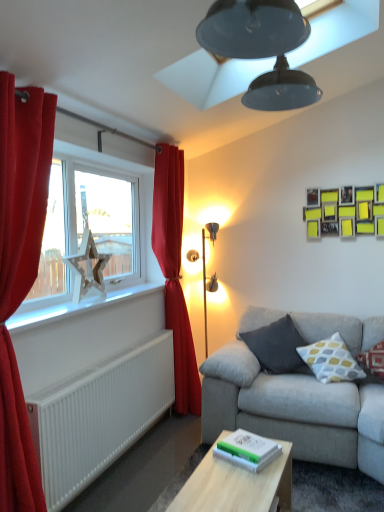
Question: Is velvet red curtain at left, the second curtain viewed from the back, bigger than white plastic window sill at left?

Choices:
 (A) yes
 (B) no

Answer: (A)

Question: Is velvet red curtain at left, marked as the 1th curtain in a front-to-back arrangement, wider than white plastic window sill at left?

Choices:
 (A) no
 (B) yes

Answer: (A)

Question: Does velvet red curtain at left, the 1th curtain in the left-to-right sequence, have a greater height compared to white plastic window sill at left?

Choices:
 (A) yes
 (B) no

Answer: (A)

Question: Is velvet red curtain at left, the 1th curtain in the left-to-right sequence, shorter than white plastic window sill at left?

Choices:
 (A) no
 (B) yes

Answer: (A)

Question: Is velvet red curtain at left, positioned as the 2th curtain in right-to-left order, positioned far away from white plastic window sill at left?

Choices:
 (A) no
 (B) yes

Answer: (A)

Question: Is yellow-grey dotted cushion at right, the second pillow from the left, inside or outside of red velvet curtain at left, the 1th curtain when ordered from right to left?

Choices:
 (A) outside
 (B) inside

Answer: (A)

Question: From a real-world perspective, relative to red velvet curtain at left, positioned as the 2th curtain in left-to-right order, is yellow-grey dotted cushion at right, which is the 2th pillow from right to left, vertically above or below?

Choices:
 (A) below
 (B) above

Answer: (A)

Question: Is yellow-grey dotted cushion at right, which is the 2th pillow from right to left, to the left or to the right of red velvet curtain at left, the 1th curtain when ordered from right to left, in the image?

Choices:
 (A) left
 (B) right

Answer: (B)

Question: Looking at their shapes, would you say yellow-grey dotted cushion at right, which is the 2th pillow from right to left, is wider or thinner than red velvet curtain at left, positioned as the 2th curtain in left-to-right order?

Choices:
 (A) thin
 (B) wide

Answer: (B)

Question: From the image's perspective, is velvet red curtain at left, marked as the 1th curtain in a front-to-back arrangement, positioned above or below gold metallic floor lamp at center?

Choices:
 (A) above
 (B) below

Answer: (A)

Question: In the image, is velvet red curtain at left, positioned as the 2th curtain in right-to-left order, on the left side or the right side of gold metallic floor lamp at center?

Choices:
 (A) left
 (B) right

Answer: (A)

Question: From a real-world perspective, is velvet red curtain at left, the 1th curtain in the left-to-right sequence, positioned above or below gold metallic floor lamp at center?

Choices:
 (A) above
 (B) below

Answer: (A)

Question: Is velvet red curtain at left, the 1th curtain in the left-to-right sequence, inside or outside of gold metallic floor lamp at center?

Choices:
 (A) outside
 (B) inside

Answer: (A)

Question: Considering the positions of point (228, 477) and point (29, 316), is point (228, 477) closer or farther from the camera than point (29, 316)?

Choices:
 (A) closer
 (B) farther

Answer: (A)

Question: Is light wood rectangular table at center to the left or to the right of white plastic window sill at left in the image?

Choices:
 (A) left
 (B) right

Answer: (B)